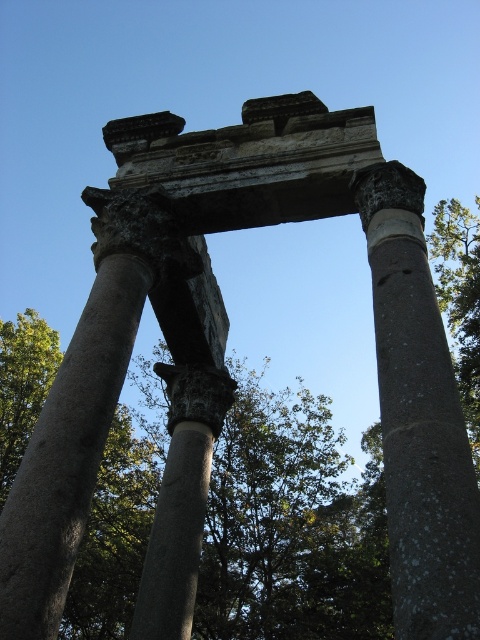
Question: Which point is closer to the camera?

Choices:
 (A) green leafy tree at center
 (B) speckled stone column at center

Answer: (B)

Question: Where is green leafy tree at center located in relation to speckled stone column at center in the image?

Choices:
 (A) right
 (B) left

Answer: (B)

Question: Can you confirm if green leafy tree at center is smaller than speckled stone column at center?

Choices:
 (A) yes
 (B) no

Answer: (B)

Question: Can you confirm if green leafy tree at center is bigger than speckled stone column at center?

Choices:
 (A) yes
 (B) no

Answer: (A)